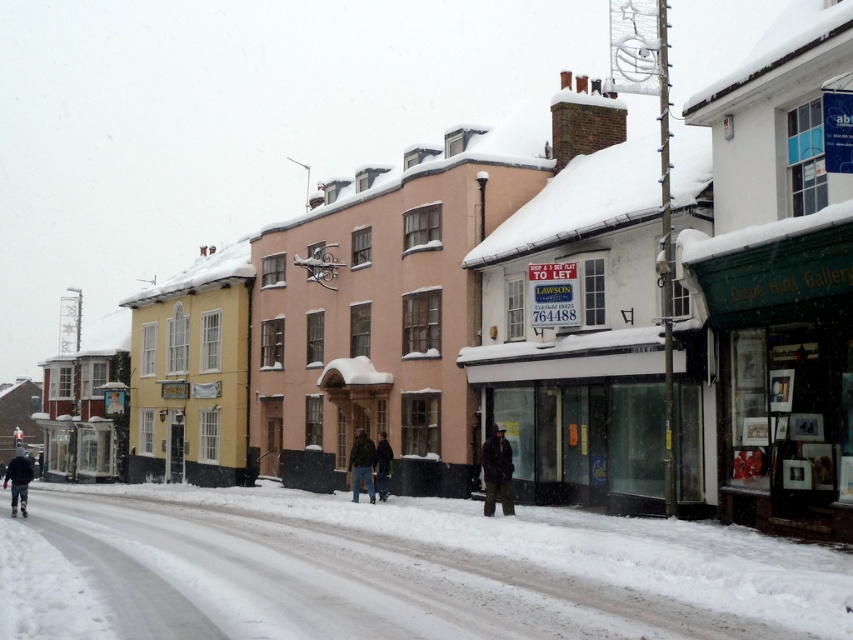
You are standing on the snowy street and want to read the text on the green matte signboard at center. Considering the distance, can you read it clearly without moving closer?

The green matte signboard at center is 44.14 feet away from the viewer. At this distance, it might be difficult to read the text clearly without moving closer.

You are standing in the snowy street scene and notice two jackets at the center of the image. Which jacket is positioned lower between the green fuzzy jacket at center and the dark green jacket at center?

The green fuzzy jacket at center is located below the dark green jacket at center, so it is positioned lower.